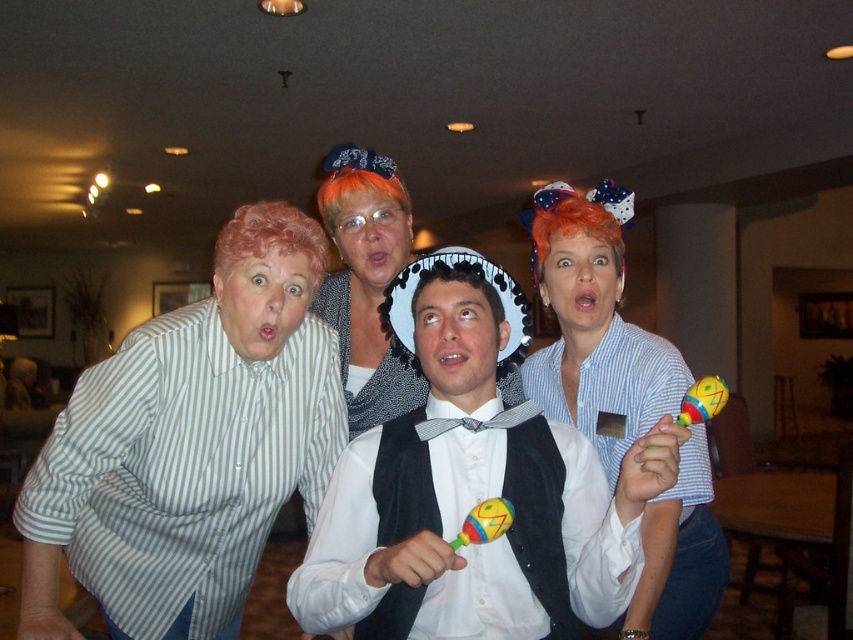
You are holding a multicolored plastic maraca at center and want to place it on a shelf. The shelf is located above the multicolored plastic maraca at lower right. Can you place the maraca on the shelf without moving the maraca at lower right?

The multicolored plastic maraca at center is positioned under the multicolored plastic maraca at lower right, so placing the maraca at center on the shelf above the maraca at lower right would require moving the maraca at lower right first.